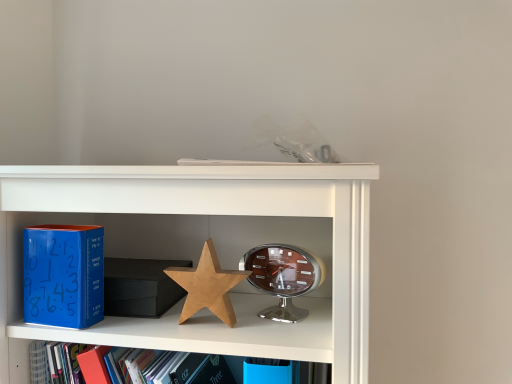
Question: Does shiny silver alarm clock at center have a lesser width compared to blue matte clock at left?

Choices:
 (A) yes
 (B) no

Answer: (B)

Question: From the image's perspective, is shiny silver alarm clock at center beneath blue matte clock at left?

Choices:
 (A) yes
 (B) no

Answer: (A)

Question: Does shiny silver alarm clock at center have a greater width compared to blue matte clock at left?

Choices:
 (A) yes
 (B) no

Answer: (A)

Question: From the image's perspective, does shiny silver alarm clock at center appear higher than blue matte clock at left?

Choices:
 (A) no
 (B) yes

Answer: (A)

Question: Is shiny silver alarm clock at center placed right next to blue matte clock at left?

Choices:
 (A) yes
 (B) no

Answer: (B)

Question: From a real-world perspective, is shiny silver alarm clock at center beneath blue matte clock at left?

Choices:
 (A) no
 (B) yes

Answer: (B)

Question: Can you confirm if blue matte clock at left is wider than wooden star at center?

Choices:
 (A) yes
 (B) no

Answer: (A)

Question: Is blue matte clock at left aimed at wooden star at center?

Choices:
 (A) no
 (B) yes

Answer: (A)

Question: From a real-world perspective, does blue matte clock at left sit lower than wooden star at center?

Choices:
 (A) yes
 (B) no

Answer: (B)

Question: Does blue matte clock at left have a greater height compared to wooden star at center?

Choices:
 (A) no
 (B) yes

Answer: (B)

Question: Is blue matte clock at left further to camera compared to wooden star at center?

Choices:
 (A) yes
 (B) no

Answer: (B)

Question: Is blue matte clock at left far from wooden star at center?

Choices:
 (A) yes
 (B) no

Answer: (B)

Question: Are blue matte clock at left and shiny silver alarm clock at center beside each other?

Choices:
 (A) no
 (B) yes

Answer: (A)